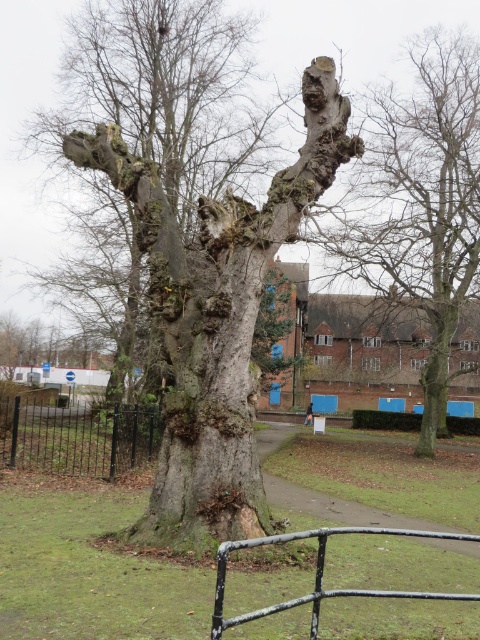
Is black metal fence at left above black metal rail at lower center?

Incorrect, black metal fence at left is not positioned above black metal rail at lower center.

Which is behind, point (104, 444) or point (320, 531)?

Positioned behind is point (104, 444).

What do you see at coordinates (78, 436) in the screenshot?
I see `black metal fence at left` at bounding box center [78, 436].

Where is `black metal fence at left`? black metal fence at left is located at coordinates (78, 436).

Does smooth bark tree at upper right have a smaller size compared to black metal rail at lower center?

Actually, smooth bark tree at upper right might be larger than black metal rail at lower center.

This screenshot has width=480, height=640. Identify the location of smooth bark tree at upper right. (419, 202).

Identify the location of smooth bark tree at upper right. (419, 202).

The height and width of the screenshot is (640, 480). I want to click on smooth bark tree at upper right, so click(419, 202).

This screenshot has width=480, height=640. What are the coordinates of `smooth gray bark at center` in the screenshot? It's located at click(x=207, y=291).

Find the location of a particular element. This screenshot has width=480, height=640. smooth gray bark at center is located at coordinates (207, 291).